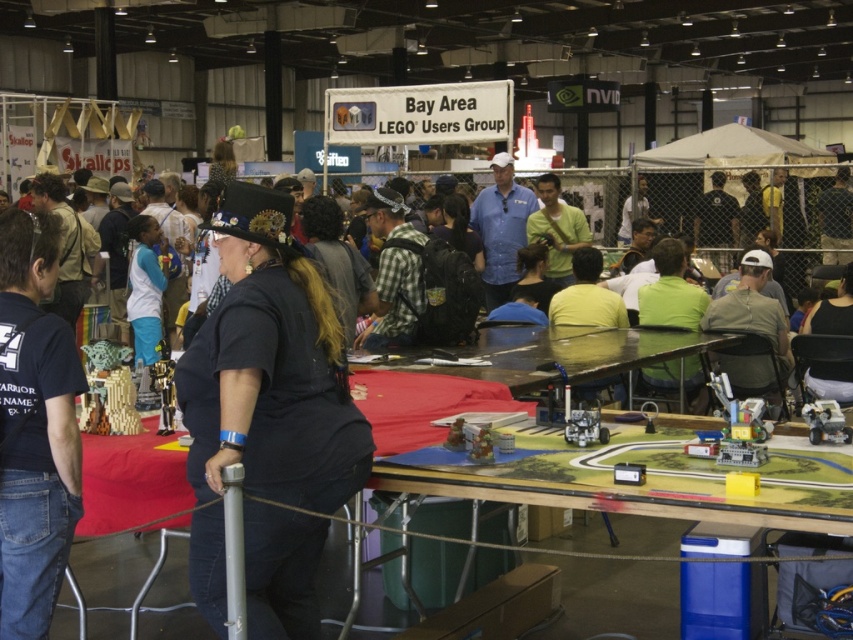
Question: Which point is closer to the camera taking this photo?

Choices:
 (A) (799, 513)
 (B) (26, 497)

Answer: (A)

Question: In this image, where is wooden table at center located relative to black t-shirt at center?

Choices:
 (A) left
 (B) right

Answer: (B)

Question: Is black t-shirt at center positioned before gray fabric shirt at right?

Choices:
 (A) no
 (B) yes

Answer: (B)

Question: Which of the following is the farthest from the observer?

Choices:
 (A) wooden table at center
 (B) gray fabric shirt at right
 (C) blue shirt at center
 (D) black matte vest at center

Answer: (C)

Question: Which is farther from the gray fabric shirt at right?

Choices:
 (A) black matte vest at center
 (B) black t-shirt at center
 (C) blue shirt at center

Answer: (B)

Question: In this image, where is gray fabric shirt at right located relative to blue shirt at center?

Choices:
 (A) below
 (B) above

Answer: (A)